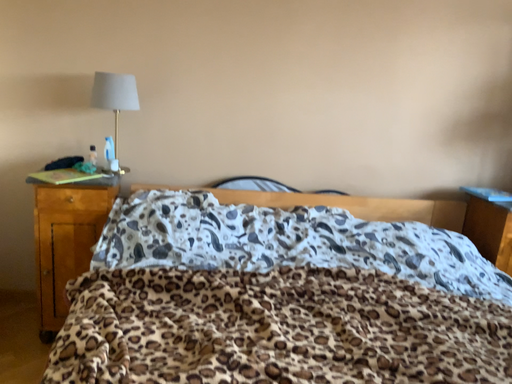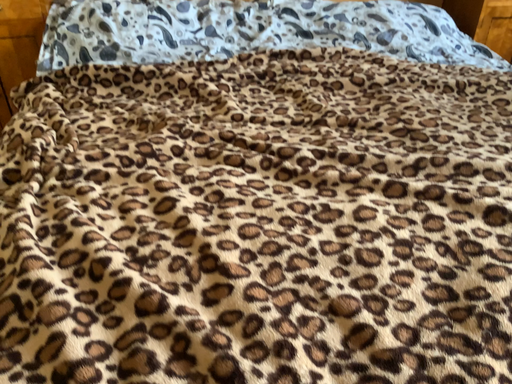
Question: How did the camera likely rotate when shooting the video?

Choices:
 (A) rotated upward
 (B) rotated downward

Answer: (B)